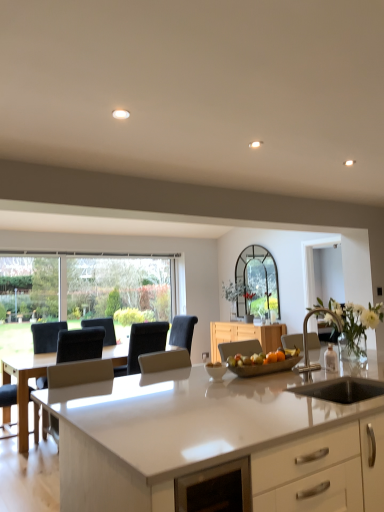
What do you see at coordinates (214, 442) in the screenshot? The width and height of the screenshot is (384, 512). I see `white glossy countertop at center` at bounding box center [214, 442].

Identify the location of white glossy countertop at center. (214, 442).

Based on the photo, what is the approximate width of metallic silver tray at center?

7.84 inches.

What do you see at coordinates (265, 367) in the screenshot? I see `metallic silver tray at center` at bounding box center [265, 367].

Find the location of a particular element. The image size is (384, 512). white glossy countertop at center is located at coordinates (214, 442).

From the image's perspective, which one is positioned higher, white leather armchair at left, placed as the 1th armchair when sorted from left to right, or metallic silver tray at center?

metallic silver tray at center is shown above in the image.

Is white leather armchair at left, the third armchair in the right-to-left sequence, beside metallic silver tray at center?

No.

Which is less distant, (85, 382) or (252, 375)?

The point (252, 375) is closer to the camera.

Who is shorter, white leather armchair at left, the third armchair in the right-to-left sequence, or metallic silver tray at center?

metallic silver tray at center is shorter.

Is black fabric armchair at center, the 3th armchair when ordered from front to back, beside satin silver armchair at center, which is counted as the third armchair, starting from the back?

black fabric armchair at center, the 3th armchair when ordered from front to back, and satin silver armchair at center, which is counted as the third armchair, starting from the back, are not in contact.

From the image's perspective, which is below, black fabric armchair at center, which is the 2th armchair in right-to-left order, or satin silver armchair at center, which ranks as the 1th armchair in right-to-left order?

From the image's view, black fabric armchair at center, which is the 2th armchair in right-to-left order, is below.

Can you tell me how much black fabric armchair at center, the 2th armchair when ordered from left to right, and satin silver armchair at center, marked as the 3th armchair in a left-to-right arrangement, differ in facing direction?

The angular difference between black fabric armchair at center, the 2th armchair when ordered from left to right, and satin silver armchair at center, marked as the 3th armchair in a left-to-right arrangement, is 2.28 degrees.

From a real-world perspective, which is physically above, satin silver armchair at center, the first armchair viewed from the front, or white glossy countertop at center?

From a 3D spatial view, satin silver armchair at center, the first armchair viewed from the front, is above.

Consider the image. Who is smaller, satin silver armchair at center, which is counted as the third armchair, starting from the back, or white glossy countertop at center?

Smaller between the two is satin silver armchair at center, which is counted as the third armchair, starting from the back.

Based on the photo, can white glossy countertop at center be found inside satin silver armchair at center, the first armchair viewed from the front?

No, white glossy countertop at center is not inside satin silver armchair at center, the first armchair viewed from the front.

Based on the photo, from a real-world perspective, is satin silver armchair at center, the first armchair viewed from the front, under black fabric armchair at center, which is the 1th armchair in back-to-front order?

No, from a real-world perspective, satin silver armchair at center, the first armchair viewed from the front, is not under black fabric armchair at center, which is the 1th armchair in back-to-front order.

Looking at their sizes, would you say satin silver armchair at center, marked as the 3th armchair in a left-to-right arrangement, is wider or thinner than black fabric armchair at center, the 2th armchair when ordered from left to right?

In the image, satin silver armchair at center, marked as the 3th armchair in a left-to-right arrangement, appears to be more narrow than black fabric armchair at center, the 2th armchair when ordered from left to right.

Is satin silver armchair at center, marked as the 3th armchair in a left-to-right arrangement, smaller than black fabric armchair at center, which is the 1th armchair in back-to-front order?

Indeed, satin silver armchair at center, marked as the 3th armchair in a left-to-right arrangement, has a smaller size compared to black fabric armchair at center, which is the 1th armchair in back-to-front order.

From the image's perspective, is satin silver armchair at center, marked as the 3th armchair in a left-to-right arrangement, beneath black fabric armchair at center, the 2th armchair when ordered from left to right?

Actually, satin silver armchair at center, marked as the 3th armchair in a left-to-right arrangement, appears above black fabric armchair at center, the 2th armchair when ordered from left to right, in the image.

From a real-world perspective, is metallic silver tray at center above or below satin silver armchair at center, the first armchair viewed from the front?

metallic silver tray at center is situated lower than satin silver armchair at center, the first armchair viewed from the front, in the real world.

Which object is further away from the camera, metallic silver tray at center or satin silver armchair at center, marked as the 3th armchair in a left-to-right arrangement?

metallic silver tray at center.

Could you measure the distance between metallic silver tray at center and satin silver armchair at center, the first armchair viewed from the front?

metallic silver tray at center and satin silver armchair at center, the first armchair viewed from the front, are 34.44 centimeters apart from each other.

Is metallic silver tray at center situated inside satin silver armchair at center, the first armchair viewed from the front, or outside?

metallic silver tray at center is located beyond the bounds of satin silver armchair at center, the first armchair viewed from the front.

Considering the relative positions of white glossy countertop at center and wooden cabinet at center in the image provided, is white glossy countertop at center to the right of wooden cabinet at center from the viewer's perspective?

Incorrect, white glossy countertop at center is not on the right side of wooden cabinet at center.

How different are the orientations of white glossy countertop at center and wooden cabinet at center in degrees?

white glossy countertop at center and wooden cabinet at center are facing 89.8 degrees away from each other.

From the image's perspective, which is below, white glossy countertop at center or wooden cabinet at center?

wooden cabinet at center is shown below in the image.

Considering their positions, is white glossy countertop at center located in front of or behind wooden cabinet at center?

In the image, white glossy countertop at center appears in front of wooden cabinet at center.

How far apart are metallic silver tray at center and white glossy countertop at center?

metallic silver tray at center and white glossy countertop at center are 28.02 inches apart.

How many degrees apart are the facing directions of metallic silver tray at center and white glossy countertop at center?

The facing directions of metallic silver tray at center and white glossy countertop at center are 1.53 degrees apart.

Is metallic silver tray at center to the left or to the right of white glossy countertop at center in the image?

Clearly, metallic silver tray at center is on the left of white glossy countertop at center in the image.

Choose the correct answer: Is metallic silver tray at center inside white glossy countertop at center or outside it?

The correct answer is: outside.

This screenshot has height=512, width=384. In order to click on the 1st armchair behind when counting from the metallic silver tray at center in this screenshot , I will do `click(79, 373)`.

Identify the location of the 1st armchair positioned below the satin silver armchair at center, which ranks as the 1th armchair in right-to-left order (from a real-world perspective). This screenshot has width=384, height=512. (143, 344).

Considering their positions, is white leather armchair at left, the 2th armchair in the front-to-back sequence, positioned closer to black fabric armchair at center, the 3th armchair when ordered from front to back, than wooden cabinet at center?

Among the two, wooden cabinet at center is located nearer to black fabric armchair at center, the 3th armchair when ordered from front to back.

Considering their positions, is white leather armchair at left, the second armchair in the back-to-front sequence, positioned closer to satin silver armchair at center, which ranks as the 1th armchair in right-to-left order, than black fabric armchair at center, which is the 2th armchair in right-to-left order?

Among the two, white leather armchair at left, the second armchair in the back-to-front sequence, is located nearer to satin silver armchair at center, which ranks as the 1th armchair in right-to-left order.

Consider the image. Which object lies further to the anchor point white leather armchair at left, the second armchair in the back-to-front sequence, black fabric armchair at center, the 3th armchair when ordered from front to back, or satin silver armchair at center, marked as the 3th armchair in a left-to-right arrangement?

Among the two, satin silver armchair at center, marked as the 3th armchair in a left-to-right arrangement, is located further to white leather armchair at left, the second armchair in the back-to-front sequence.

Considering their positions, is black fabric armchair at center, which is the 2th armchair in right-to-left order, positioned closer to wooden cabinet at center than metallic silver tray at center?

black fabric armchair at center, which is the 2th armchair in right-to-left order, is closer to wooden cabinet at center.

When comparing their distances from wooden cabinet at center, does satin silver armchair at center, which is counted as the third armchair, starting from the back, or metallic silver tray at center seem closer?

satin silver armchair at center, which is counted as the third armchair, starting from the back.

When comparing their distances from wooden cabinet at center, does white glossy countertop at center or satin silver armchair at center, marked as the 3th armchair in a left-to-right arrangement, seem further?

white glossy countertop at center is further to wooden cabinet at center.

Looking at the image, which one is located closer to white leather armchair at left, the second armchair in the back-to-front sequence, satin silver armchair at center, which is counted as the third armchair, starting from the back, or metallic silver tray at center?

metallic silver tray at center.

Which object lies further to the anchor point black fabric armchair at center, the 3th armchair when ordered from front to back, wooden cabinet at center or satin silver armchair at center, which ranks as the 1th armchair in right-to-left order?

Among the two, satin silver armchair at center, which ranks as the 1th armchair in right-to-left order, is located further to black fabric armchair at center, the 3th armchair when ordered from front to back.

Where is `tray located between white leather armchair at left, the second armchair in the back-to-front sequence, and satin silver armchair at center, which is counted as the third armchair, starting from the back, in the left-right direction`? The height and width of the screenshot is (512, 384). tray located between white leather armchair at left, the second armchair in the back-to-front sequence, and satin silver armchair at center, which is counted as the third armchair, starting from the back, in the left-right direction is located at coordinates (265, 367).

I want to click on tray positioned between white glossy countertop at center and wooden cabinet at center from near to far, so click(265, 367).

The image size is (384, 512). Identify the location of armchair between white leather armchair at left, the third armchair in the right-to-left sequence, and wooden cabinet at center from front to back. (143, 344).

Locate an element on the screen. The width and height of the screenshot is (384, 512). tray between white glossy countertop at center and white leather armchair at left, the third armchair in the right-to-left sequence, in the front-back direction is located at coordinates coord(265,367).